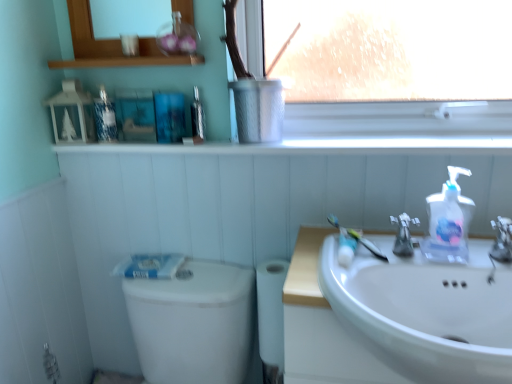
Where is `vacant area to the right of blue textured bottle at upper left, which is the 1th mouthwash from left to right`? This screenshot has width=512, height=384. vacant area to the right of blue textured bottle at upper left, which is the 1th mouthwash from left to right is located at coordinates (142, 142).